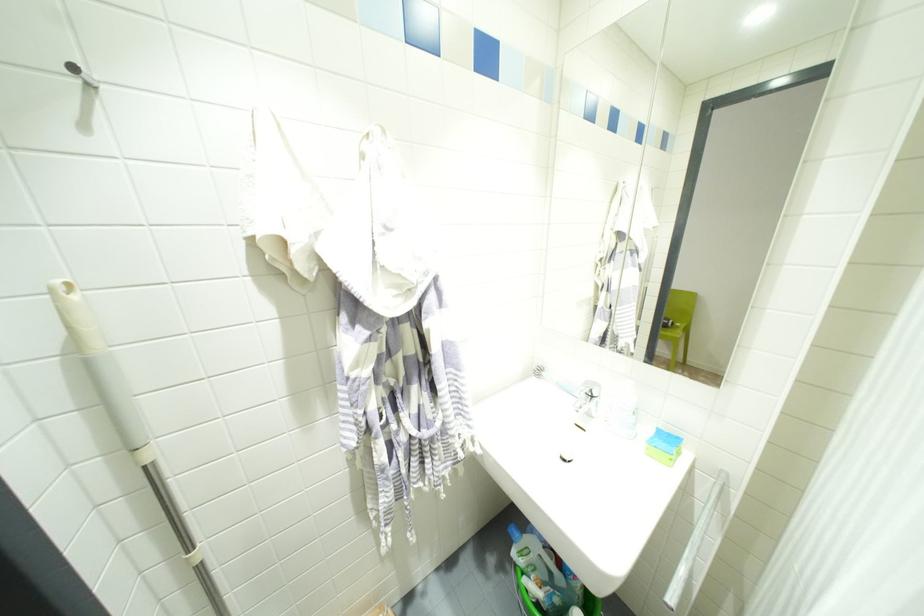
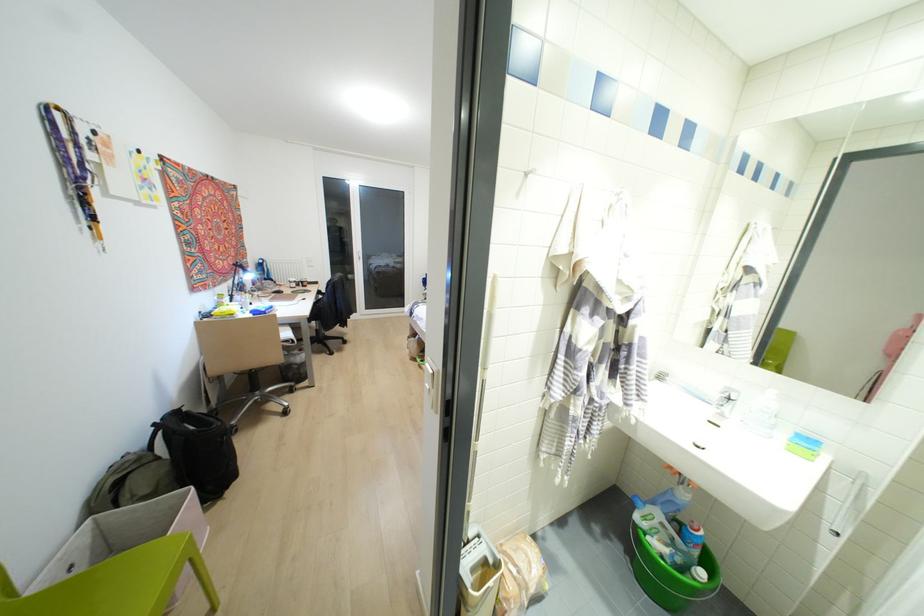
In the second image, find the point that corresponds to pixel 589 415 in the first image.

(721, 415)